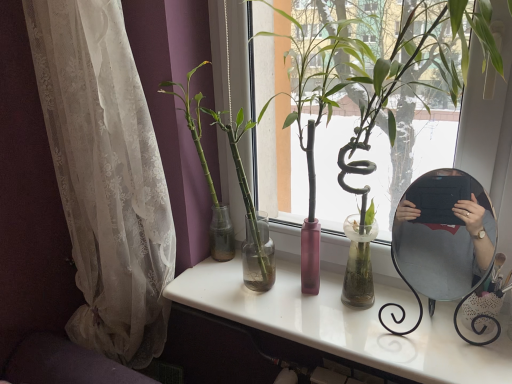
Question: Would you say white glossy desk at center is part of white lace curtain at left's contents?

Choices:
 (A) yes
 (B) no

Answer: (B)

Question: Considering the relative positions of white lace curtain at left and white glossy desk at center in the image provided, is white lace curtain at left to the right of white glossy desk at center from the viewer's perspective?

Choices:
 (A) yes
 (B) no

Answer: (B)

Question: From the image's perspective, does white lace curtain at left appear higher than white glossy desk at center?

Choices:
 (A) yes
 (B) no

Answer: (A)

Question: From a real-world perspective, does white lace curtain at left stand above white glossy desk at center?

Choices:
 (A) no
 (B) yes

Answer: (B)

Question: Does white lace curtain at left have a lesser width compared to white glossy desk at center?

Choices:
 (A) no
 (B) yes

Answer: (B)

Question: Does point (74, 94) appear closer or farther from the camera than point (415, 264)?

Choices:
 (A) closer
 (B) farther

Answer: (A)

Question: In the image, is white lace curtain at left on the left side or the right side of metallic silver mirror at right?

Choices:
 (A) right
 (B) left

Answer: (B)

Question: From the image's perspective, is white lace curtain at left located above or below metallic silver mirror at right?

Choices:
 (A) below
 (B) above

Answer: (B)

Question: Considering the positions of white lace curtain at left and metallic silver mirror at right in the image, is white lace curtain at left bigger or smaller than metallic silver mirror at right?

Choices:
 (A) big
 (B) small

Answer: (A)

Question: From the image's perspective, is green glossy bamboo at center, arranged as the 1th houseplant when viewed from the right, positioned above or below green glass vase at center, which is the 1th houseplant in left-to-right order?

Choices:
 (A) below
 (B) above

Answer: (B)

Question: Is green glossy bamboo at center, arranged as the 1th houseplant when viewed from the right, wider or thinner than green glass vase at center, which ranks as the 2th houseplant in right-to-left order?

Choices:
 (A) wide
 (B) thin

Answer: (A)

Question: Looking at the image, does green glossy bamboo at center, arranged as the 1th houseplant when viewed from the right, seem bigger or smaller compared to green glass vase at center, which is the 1th houseplant in left-to-right order?

Choices:
 (A) big
 (B) small

Answer: (A)

Question: Is green glossy bamboo at center, arranged as the 1th houseplant when viewed from the right, taller or shorter than green glass vase at center, which is the 1th houseplant in left-to-right order?

Choices:
 (A) short
 (B) tall

Answer: (B)

Question: Is green glossy bamboo at center, which is the second houseplant from left to right, bigger or smaller than white glossy desk at center?

Choices:
 (A) big
 (B) small

Answer: (A)

Question: Is green glossy bamboo at center, arranged as the 1th houseplant when viewed from the right, taller or shorter than white glossy desk at center?

Choices:
 (A) tall
 (B) short

Answer: (A)